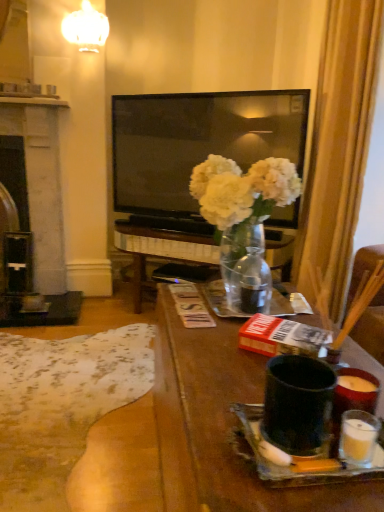
Question: Considering the positions of point (29, 104) and point (221, 433), is point (29, 104) closer or farther from the camera than point (221, 433)?

Choices:
 (A) closer
 (B) farther

Answer: (B)

Question: In terms of width, does black stone fireplace at left look wider or thinner when compared to matte black mug at center?

Choices:
 (A) thin
 (B) wide

Answer: (B)

Question: Estimate the real-world distances between objects in this image. Which object is farther from the translucent glass vase at center?

Choices:
 (A) white glossy lampshade at upper center
 (B) matte black mug at center
 (C) black stone fireplace at left
 (D) silky gold curtain at right

Answer: (A)

Question: Based on their relative distances, which object is nearer to the white glossy lampshade at upper center?

Choices:
 (A) silky gold curtain at right
 (B) matte black mug at center
 (C) black stone fireplace at left
 (D) translucent glass vase at center

Answer: (C)